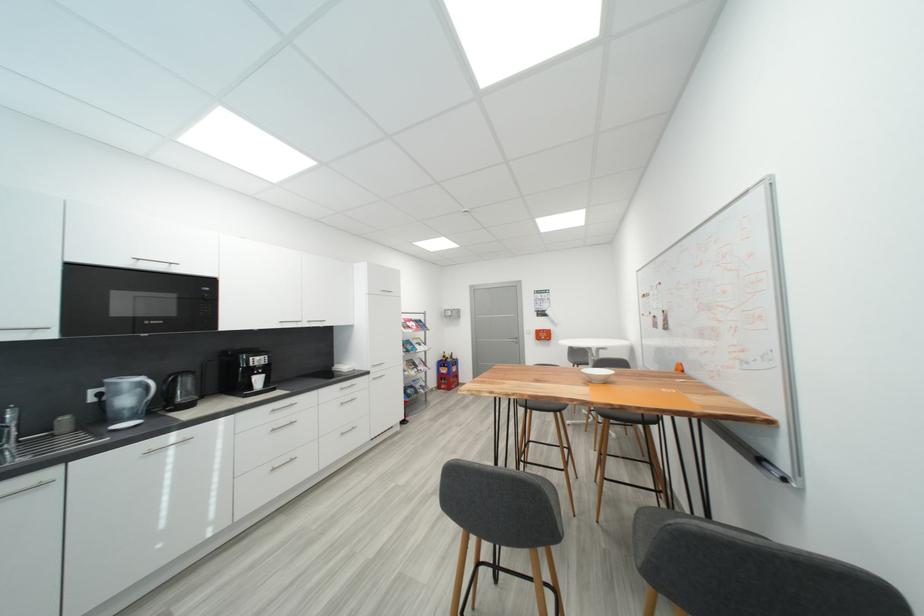
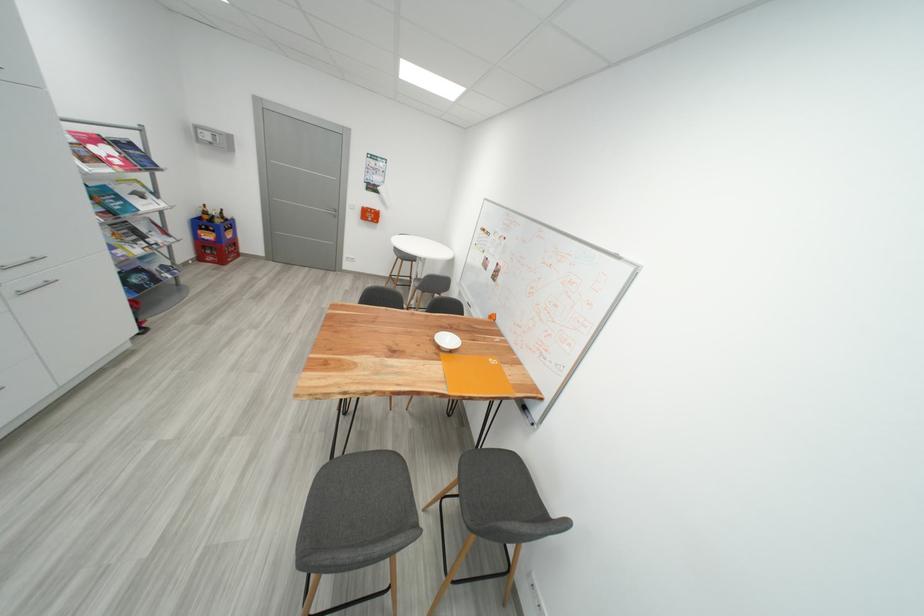
How did the camera likely rotate?

The camera rotated toward right-down.